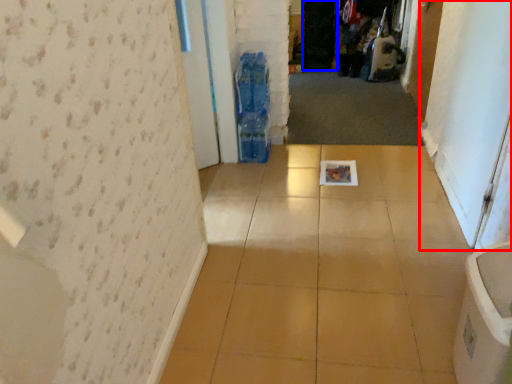
Question: Which object is further to the camera taking this photo, screen door (highlighted by a red box) or screen door (highlighted by a blue box)?

Choices:
 (A) screen door
 (B) screen door

Answer: (B)